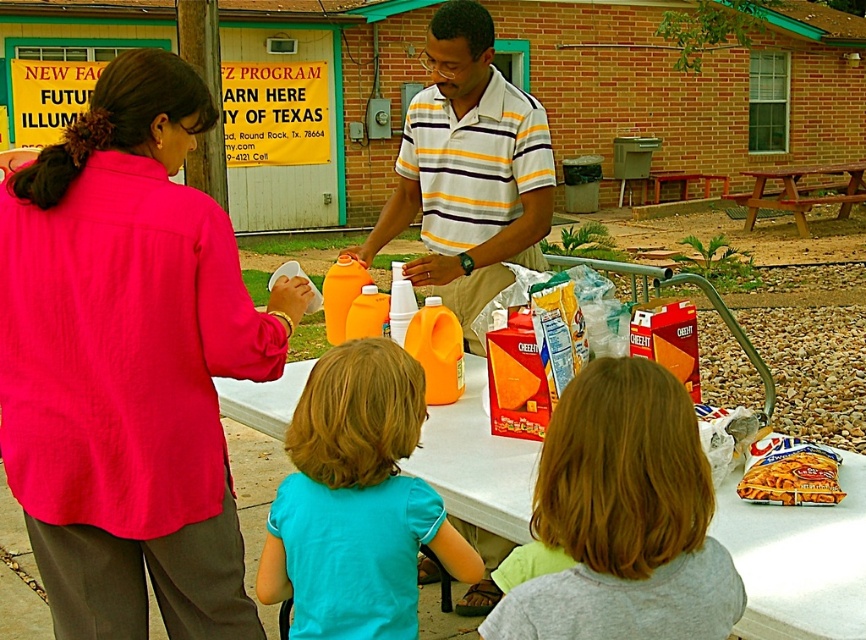
You are a participant at the event and need to reach the teal cotton shirt at center to ask a question. The wooden picnic table at center is blocking your path. Can you go around the table to reach the shirt?

The teal cotton shirt at center is below the wooden picnic table at center, meaning the shirt is positioned under the table. Since the table is blocking your path, you can go around the table to reach the shirt located underneath.

You are a volunteer at the event and need to hand out shirts to participants. You see the striped cotton shirt at center and the striped cotton polo shirt at center. Which one is positioned lower on the person?

The striped cotton shirt at center is positioned lower than the striped cotton polo shirt at center.

You are organizing a community event and need to determine if the matte pink blouse at center can be placed on the white plastic table at lower center without any issues. Based on their sizes, what would you advise?

The matte pink blouse at center is bigger than the white plastic table at lower center, so it may not fit properly. Consider using a larger table or folding the blouse to accommodate it.